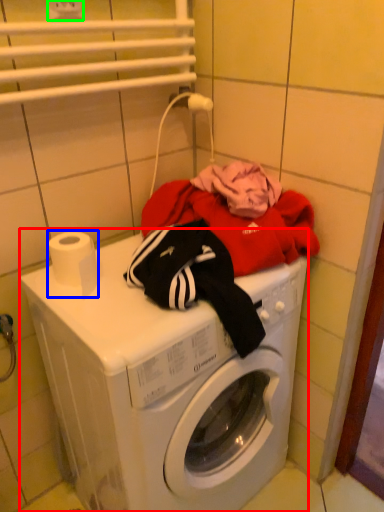
Question: Based on their relative distances, which object is farther from washing machine (highlighted by a red box)? Choose from toilet paper (highlighted by a blue box) and electric outlet (highlighted by a green box).

Choices:
 (A) toilet paper
 (B) electric outlet

Answer: (B)